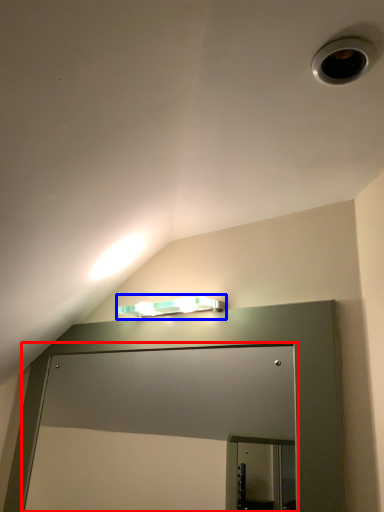
Question: Which point is further to the camera, glass door (highlighted by a red box) or lamp (highlighted by a blue box)?

Choices:
 (A) glass door
 (B) lamp

Answer: (B)